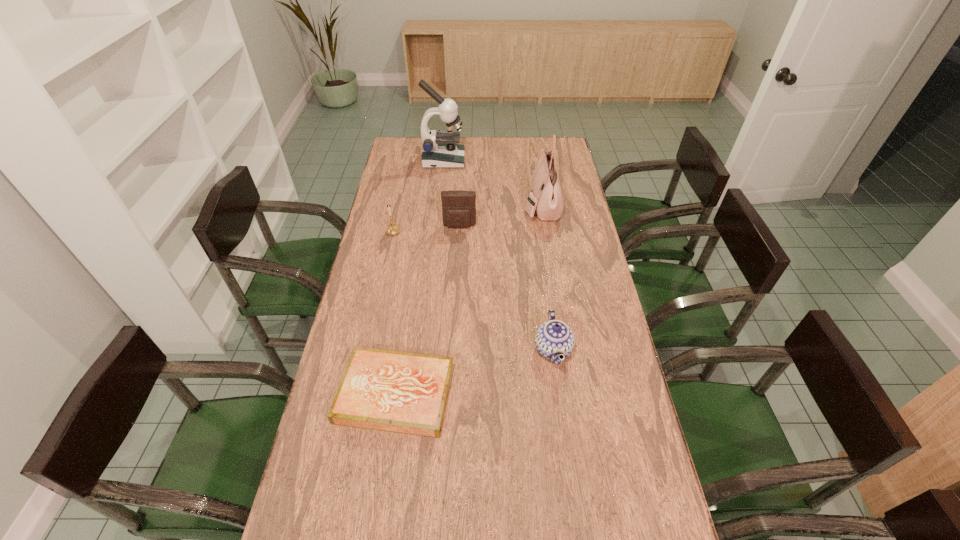
Where is `free region that satisfies the following two spatial constraints: 1. on the side of the fifth shortest object with the attached pouch; 2. on the front side of the hardback book`? Image resolution: width=960 pixels, height=540 pixels. free region that satisfies the following two spatial constraints: 1. on the side of the fifth shortest object with the attached pouch; 2. on the front side of the hardback book is located at coordinates (572, 394).